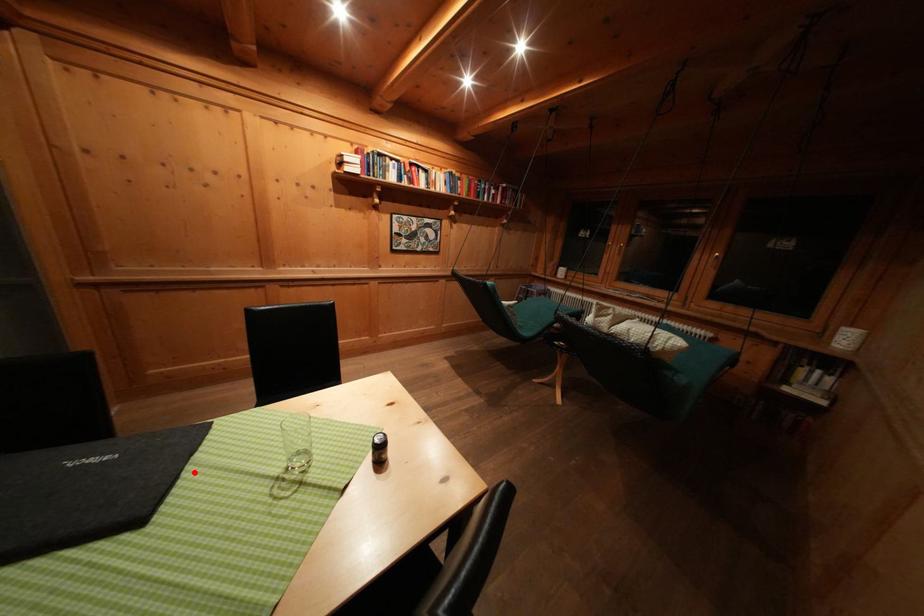
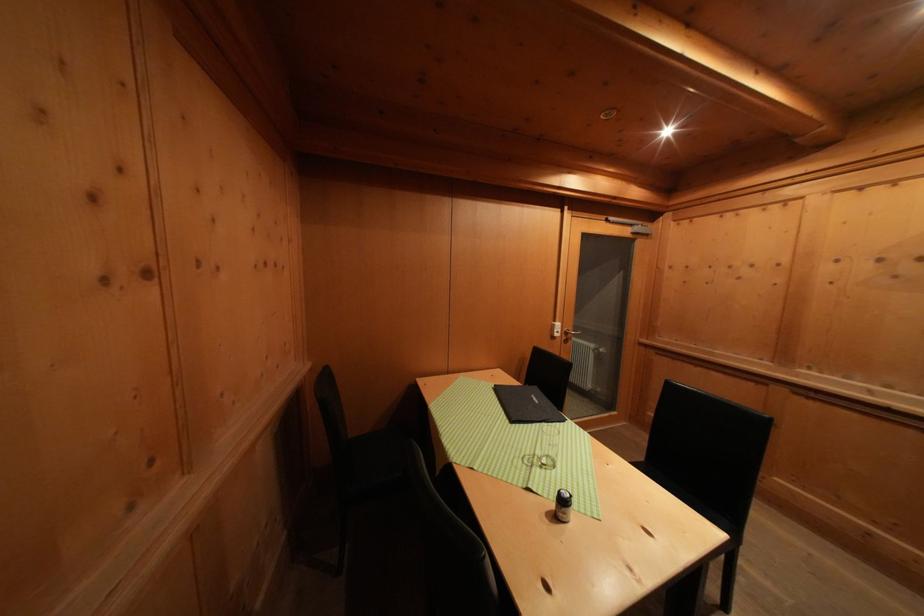
The point at the highlighted location is marked in the first image. Where is the corresponding point in the second image?

(543, 429)